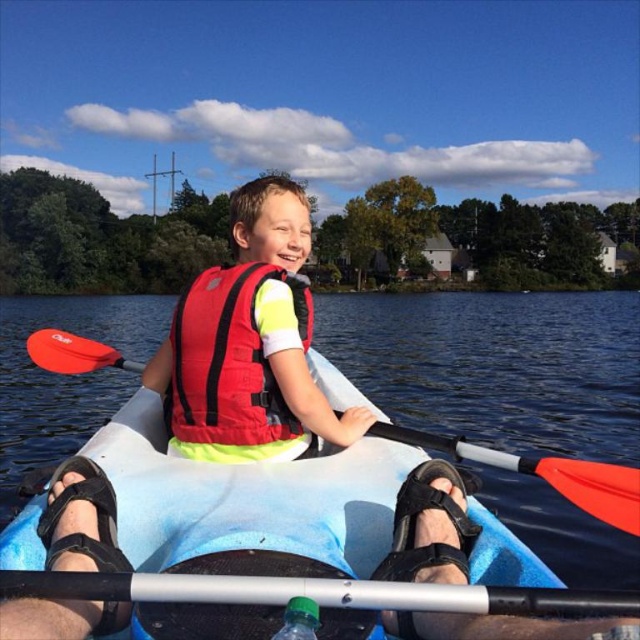
Does red nylon life jacket at center have a larger size compared to black plastic paddle at lower center?

Indeed, red nylon life jacket at center has a larger size compared to black plastic paddle at lower center.

Who is positioned more to the left, red nylon life jacket at center or black plastic paddle at lower center?

From the viewer's perspective, red nylon life jacket at center appears more on the left side.

Does point (173, 433) come in front of point (536, 595)?

No.

Locate an element on the screen. The image size is (640, 640). red nylon life jacket at center is located at coordinates (228, 358).

Between matte red life vest at center and black plastic paddle at lower center, which one appears on the right side from the viewer's perspective?

From the viewer's perspective, black plastic paddle at lower center appears more on the right side.

Is matte red life vest at center taller than black plastic paddle at lower center?

Correct, matte red life vest at center is much taller as black plastic paddle at lower center.

Who is more forward, [227,305] or [237,579]?

Point [237,579] is in front.

This screenshot has height=640, width=640. Find the location of `matte red life vest at center`. matte red life vest at center is located at coordinates [x=250, y=342].

Consider the image. Does red nylon life jacket at center have a smaller size compared to orange paddle at center?

Yes.

Is red nylon life jacket at center further to camera compared to orange paddle at center?

Yes.

Where is `red nylon life jacket at center`? red nylon life jacket at center is located at coordinates (228, 358).